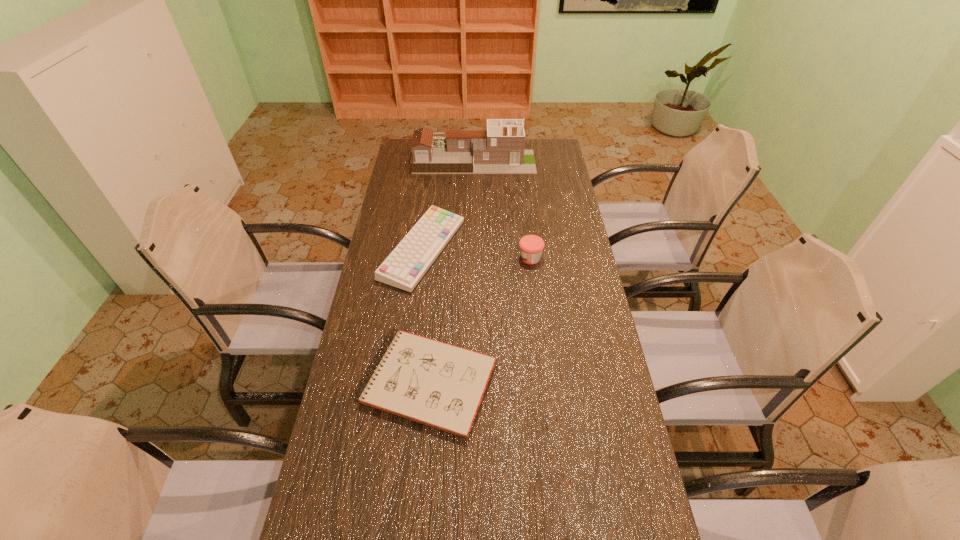
I want to click on the tallest object, so click(x=500, y=150).

This screenshot has width=960, height=540. Identify the location of the farthest object. (500, 150).

At what (x,y) coordinates should I click in order to perform the action: click on the second tallest object. Please return your answer as a coordinate pair (x, y). The height and width of the screenshot is (540, 960). Looking at the image, I should click on (531, 246).

Where is `the second shortest object`? The width and height of the screenshot is (960, 540). the second shortest object is located at coordinates (405, 266).

Identify the location of the shortest object. tap(440, 385).

This screenshot has width=960, height=540. I want to click on notepad, so click(440, 385).

Where is `vacant position located 0.130m at the main entrance of the farthest object`? This screenshot has height=540, width=960. vacant position located 0.130m at the main entrance of the farthest object is located at coordinates (563, 160).

I want to click on free region located 0.350m on the front label of the jam, so click(x=422, y=258).

Where is `vacant region located 0.080m on the front label of the jam`? The height and width of the screenshot is (540, 960). vacant region located 0.080m on the front label of the jam is located at coordinates click(496, 258).

This screenshot has width=960, height=540. I want to click on vacant space located on the front label of the jam, so click(414, 258).